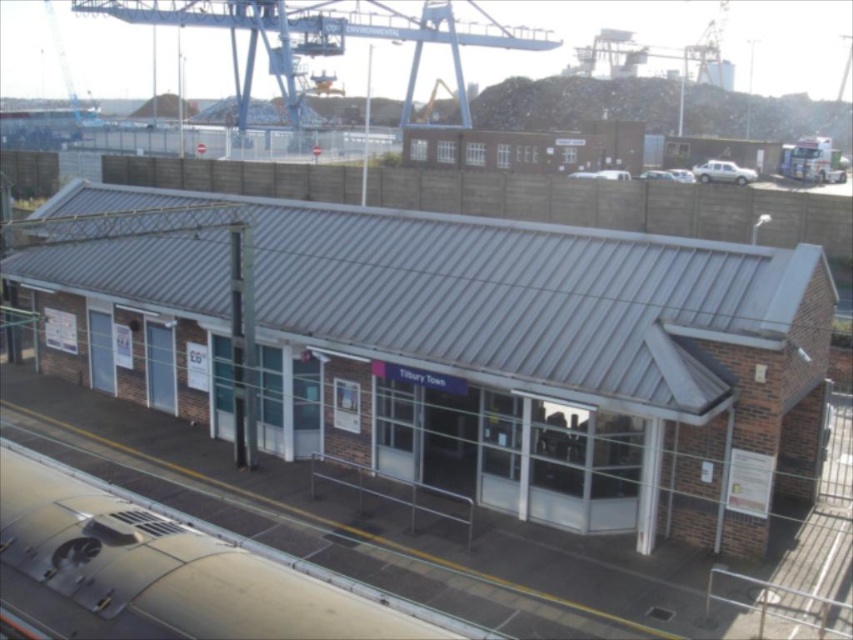
You are a passenger standing at the metallic brick shed at center and want to board the metallic silver train at lower center. Which direction should you walk to reach the train?

The metallic brick shed at center is to the left of the metallic silver train at lower center, so you should walk to the right to reach the train.

You are standing at the entrance of the building and want to locate the metallic brick shed at center. According to the coordinates provided, where should you look relative to your current position?

The metallic brick shed at center is located at coordinates point (535, 360), which would be slightly to the right and forward from your current position at the entrance.

You are a delivery driver who needs to park your truck near the metallic brick shed at center and the blue metallic crane at upper center. Based on their positions, which object should you park closer to if you want to be equidistant from both?

You should park closer to the metallic brick shed at center because it is below the blue metallic crane at upper center, so positioning yourself between them would require being closer to the lower object to maintain equal distance.